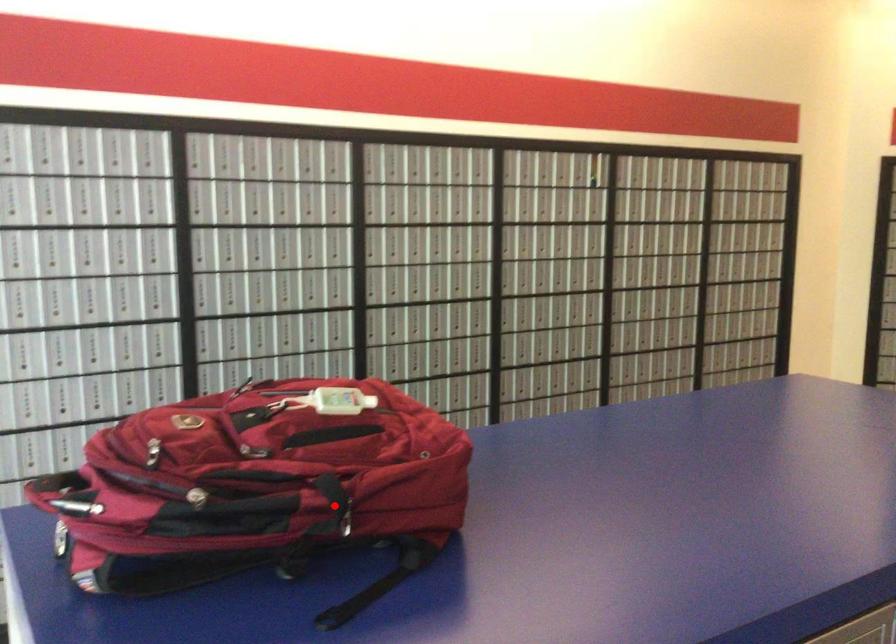
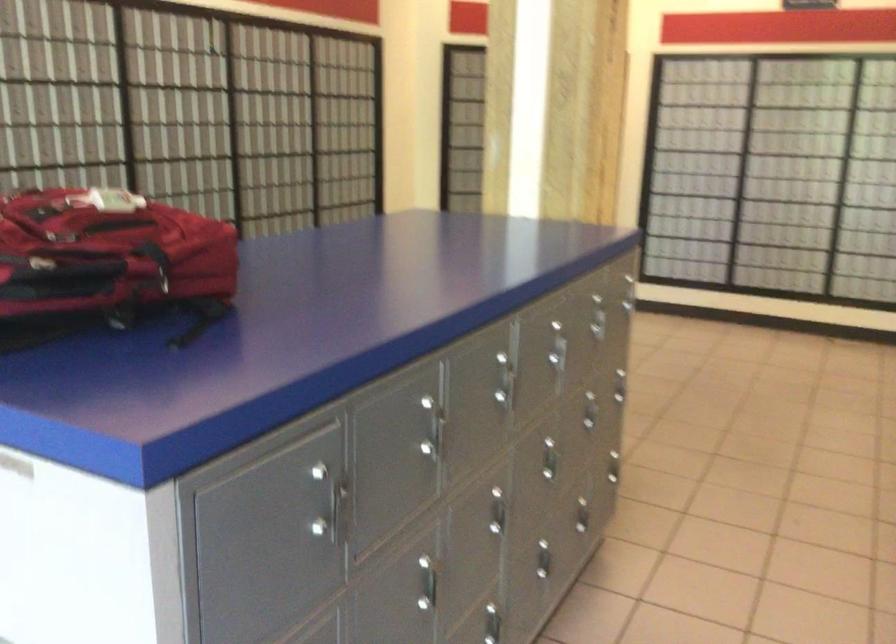
Find the pixel in the second image that matches the highlighted location in the first image.

(156, 263)